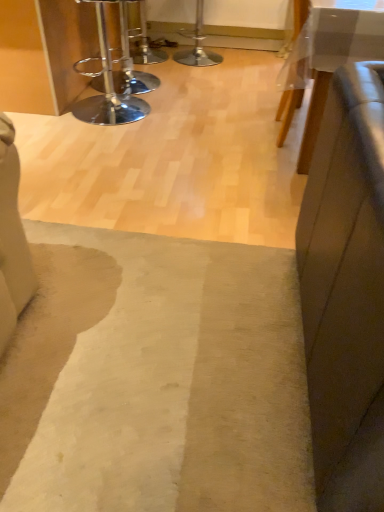
Identify the location of blank space above beige woolen mat at center (from a real-world perspective). The image size is (384, 512). (140, 327).